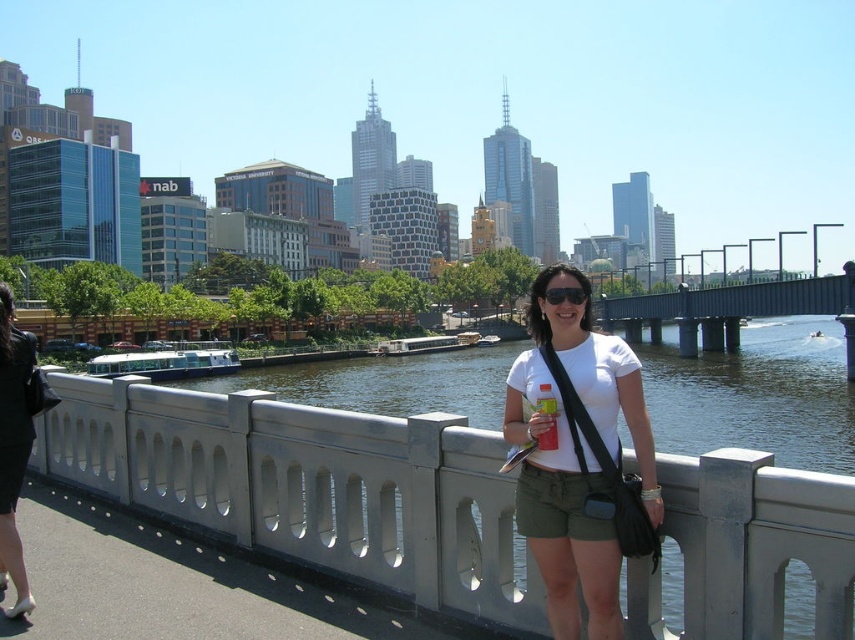
Does white matte t-shirt at center appear under black leather jacket at left?

Incorrect, white matte t-shirt at center is not positioned below black leather jacket at left.

Is white matte t-shirt at center shorter than black leather jacket at left?

No, white matte t-shirt at center is not shorter than black leather jacket at left.

Is point (537, 483) farther from viewer compared to point (16, 564)?

No, (537, 483) is in front of (16, 564).

Find the location of a particular element. white matte t-shirt at center is located at coordinates (576, 454).

Which of these two, white matte t-shirt at center or gray concrete bridge at center, stands shorter?

white matte t-shirt at center

You are a GUI agent. You are given a task and a screenshot of the screen. Output one action in this format:
    pyautogui.click(x=<x>, y=<y>)
    Task: Click on the white matte t-shirt at center
    
    Given the screenshot: What is the action you would take?
    pyautogui.click(x=576, y=454)

This screenshot has width=855, height=640. I want to click on white matte t-shirt at center, so click(576, 454).

Is black leather jacket at left shorter than black matte sunglasses at center?

No.

Can you confirm if black leather jacket at left is taller than black matte sunglasses at center?

Yes, black leather jacket at left is taller than black matte sunglasses at center.

Is point (1, 566) positioned before point (549, 291)?

No.

Find the location of `black leather jacket at left`. black leather jacket at left is located at coordinates click(15, 444).